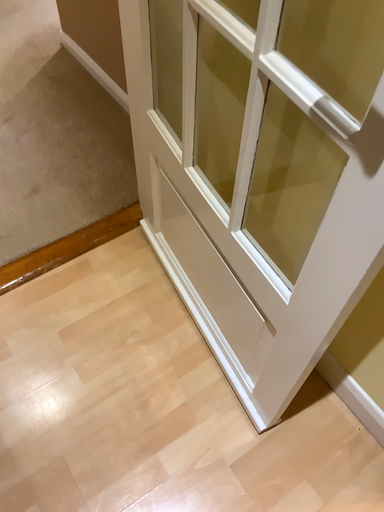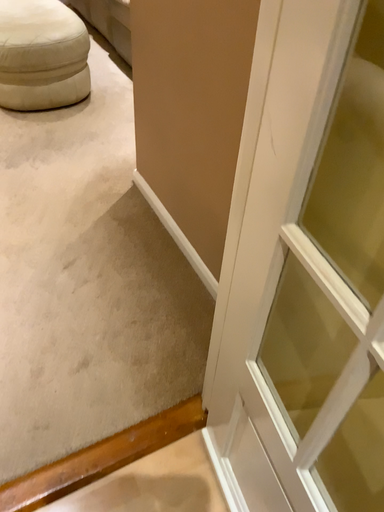
Question: Which way did the camera rotate in the video?

Choices:
 (A) rotated downward
 (B) rotated upward

Answer: (B)